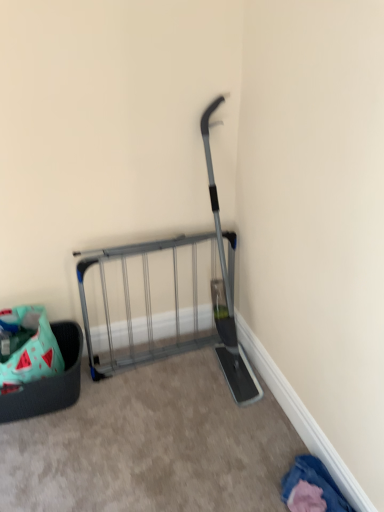
Measure the distance between point [146,349] and camera.

The depth of point [146,349] is 2.22 meters.

In order to face denim fabric pants at lower right, should I rotate leftwards or rightwards?

You should rotate right by 15.831 degrees.

Where is `mint fabric basket at lower left`? This screenshot has height=512, width=384. mint fabric basket at lower left is located at coordinates (49, 380).

At what (x,y) coordinates should I click in order to perform the action: click on silver metallic gate at center. Please return your answer as a coordinate pair (x, y). The image size is (384, 512). Looking at the image, I should click on (x=145, y=301).

What are the coordinates of `furniture behind the denim fabric pants at lower right` in the screenshot? It's located at (49, 380).

From the image's perspective, is mint fabric basket at lower left under denim fabric pants at lower right?

No, from the image's perspective, mint fabric basket at lower left is not below denim fabric pants at lower right.

Considering the sizes of mint fabric basket at lower left and denim fabric pants at lower right in the image, is mint fabric basket at lower left wider or thinner than denim fabric pants at lower right?

Clearly, mint fabric basket at lower left has more width compared to denim fabric pants at lower right.

Is silver metallic gate at center taller than mint fabric basket at lower left?

Indeed, silver metallic gate at center has a greater height compared to mint fabric basket at lower left.

Relative to mint fabric basket at lower left, is silver metallic gate at center in front or behind?

silver metallic gate at center is positioned farther from the viewer than mint fabric basket at lower left.

Which is closer to the camera, (145,249) or (81,356)?

Point (145,249) appears to be closer to the viewer than point (81,356).

Is denim fabric pants at lower right positioned behind mint fabric basket at lower left?

No.

From their relative heights in the image, would you say denim fabric pants at lower right is taller or shorter than mint fabric basket at lower left?

In the image, denim fabric pants at lower right appears to be shorter than mint fabric basket at lower left.

Is point (340, 506) behind point (36, 409)?

No, it is in front of (36, 409).

From the image's perspective, is denim fabric pants at lower right below silver metallic gate at center?

Yes, from the image's perspective, denim fabric pants at lower right is beneath silver metallic gate at center.

Is denim fabric pants at lower right wider than silver metallic gate at center?

Correct, the width of denim fabric pants at lower right exceeds that of silver metallic gate at center.

Between denim fabric pants at lower right and silver metallic gate at center, which one has larger size?

silver metallic gate at center is bigger.

From the image's perspective, which is above, silver metallic gate at center or denim fabric pants at lower right?

silver metallic gate at center is shown above in the image.

Does silver metallic gate at center turn towards denim fabric pants at lower right?

Yes, silver metallic gate at center is oriented towards denim fabric pants at lower right.

Is silver metallic gate at center next to denim fabric pants at lower right?

No, silver metallic gate at center is not with denim fabric pants at lower right.

From a real-world perspective, between mint fabric basket at lower left and silver metallic gate at center, who is vertically lower?

mint fabric basket at lower left.

Which point is more forward, [75,325] or [86,336]?

Point [75,325]

Can you confirm if mint fabric basket at lower left is wider than silver metallic gate at center?

Yes, mint fabric basket at lower left is wider than silver metallic gate at center.

In order to click on furniture on the left of denim fabric pants at lower right in this screenshot , I will do `click(49, 380)`.

Identify the location of cart above the mint fabric basket at lower left (from a real-world perspective). (145, 301).

Which object lies nearer to the anchor point mint fabric basket at lower left, denim fabric pants at lower right or silver metallic gate at center?

silver metallic gate at center is positioned closer to the anchor mint fabric basket at lower left.

Considering their positions, is mint fabric basket at lower left positioned closer to denim fabric pants at lower right than silver metallic gate at center?

silver metallic gate at center lies closer to denim fabric pants at lower right than the other object.

Based on the photo, based on their spatial positions, is silver metallic gate at center or mint fabric basket at lower left closer to denim fabric pants at lower right?

The object closer to denim fabric pants at lower right is silver metallic gate at center.

Which object lies nearer to the anchor point mint fabric basket at lower left, silver metallic gate at center or denim fabric pants at lower right?

silver metallic gate at center is positioned closer to the anchor mint fabric basket at lower left.

Estimate the real-world distances between objects in this image. Which object is further from silver metallic gate at center, mint fabric basket at lower left or denim fabric pants at lower right?

The object further to silver metallic gate at center is denim fabric pants at lower right.

Looking at the image, which one is located closer to silver metallic gate at center, denim fabric pants at lower right or mint fabric basket at lower left?

Based on the image, mint fabric basket at lower left appears to be nearer to silver metallic gate at center.

The height and width of the screenshot is (512, 384). Identify the location of cart between mint fabric basket at lower left and denim fabric pants at lower right in the horizontal direction. (145, 301).